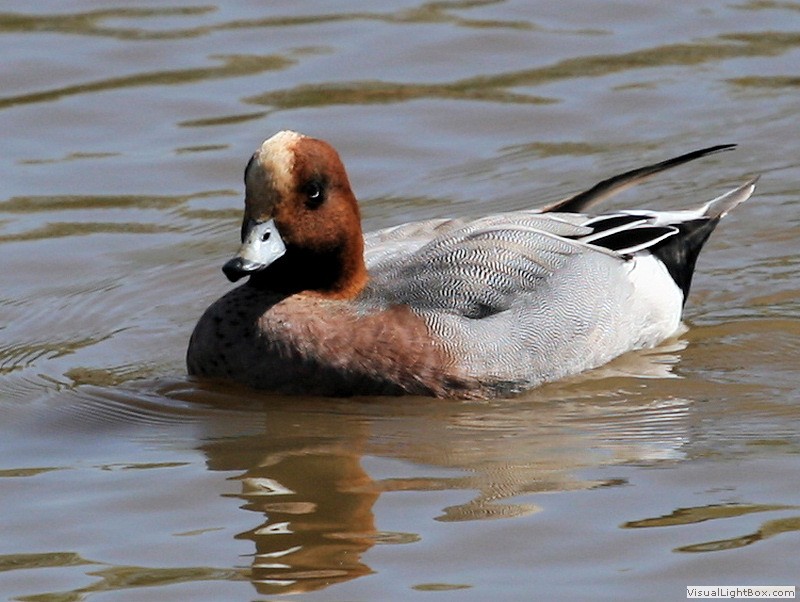
What are the coordinates of `chest` in the screenshot? It's located at (237, 351).